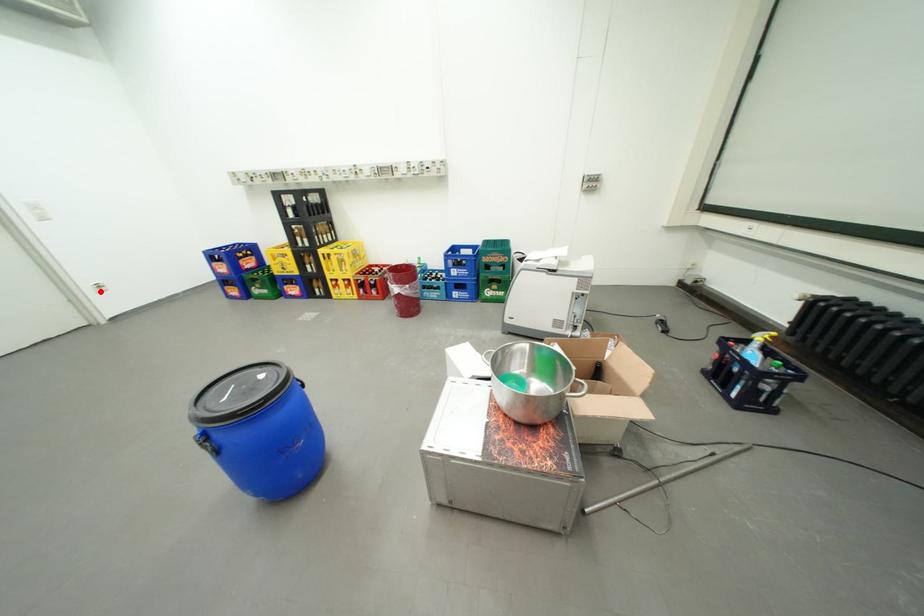
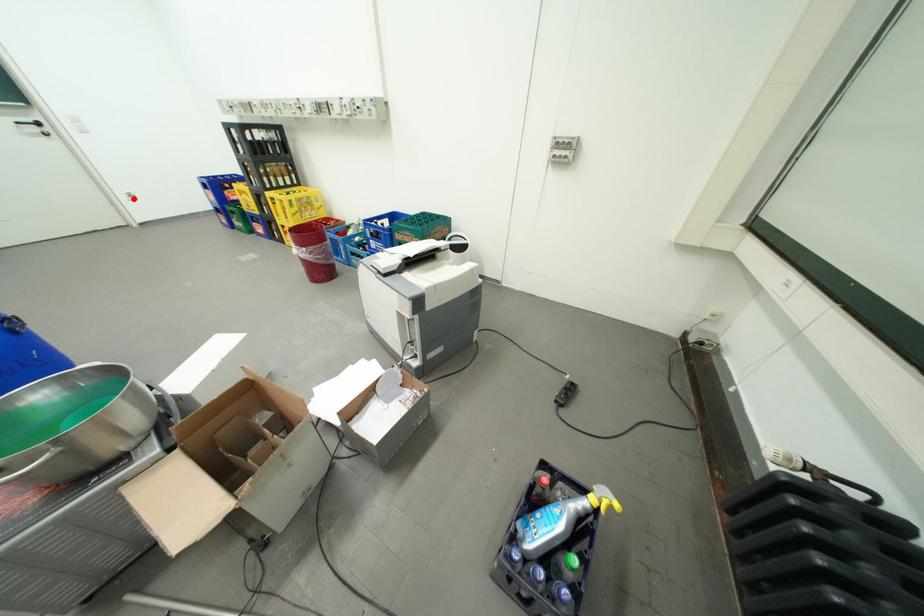
I am providing you with two images of the same scene from different viewpoints. A red point is marked on the first image and another point is marked on the second image. Does the point marked in image1 correspond to the same location as the one in image2?

Yes